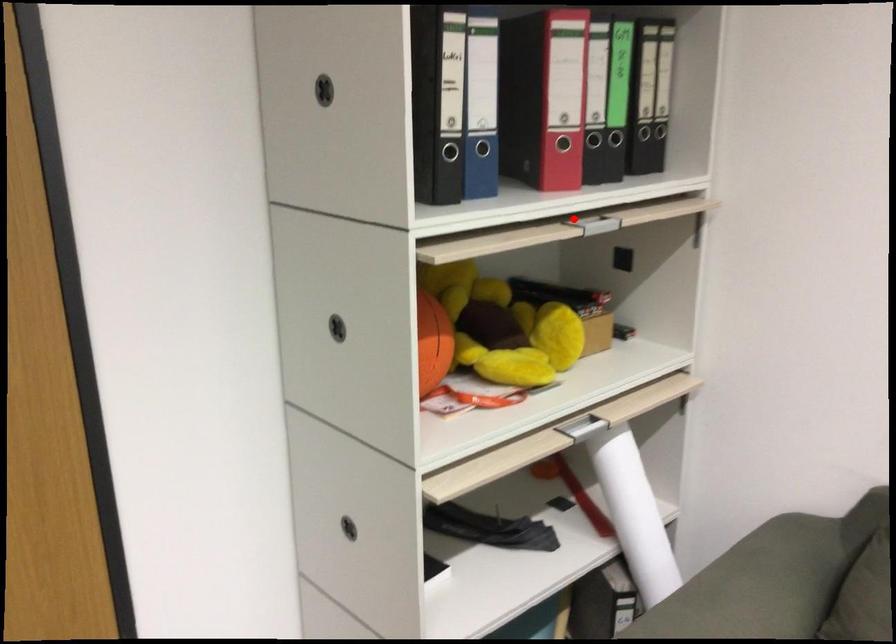
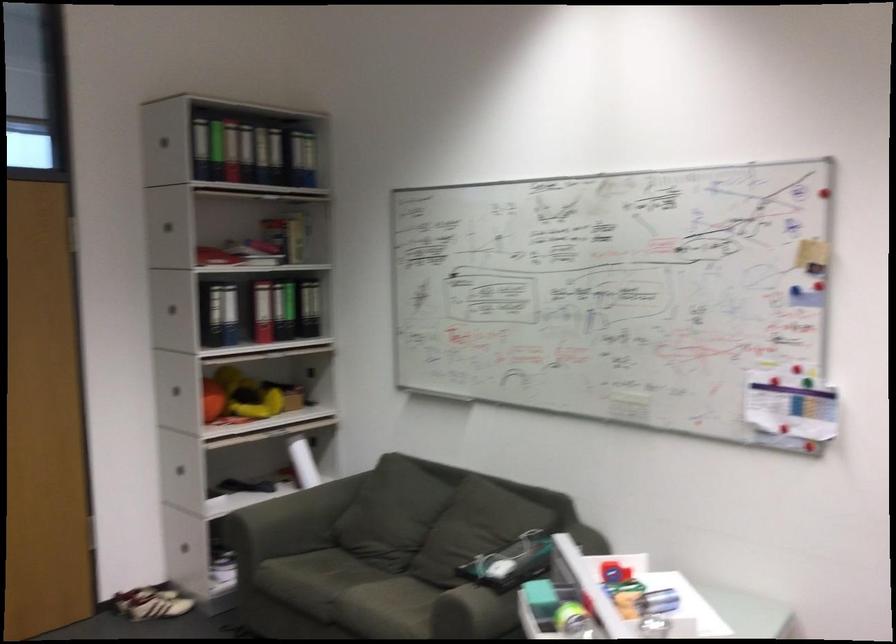
Question: I am providing you with two images of the same scene from different viewpoints. A red point is marked on the first image. Is the red point's position out of view in image 2?

Choices:
 (A) Yes
 (B) No

Answer: (A)